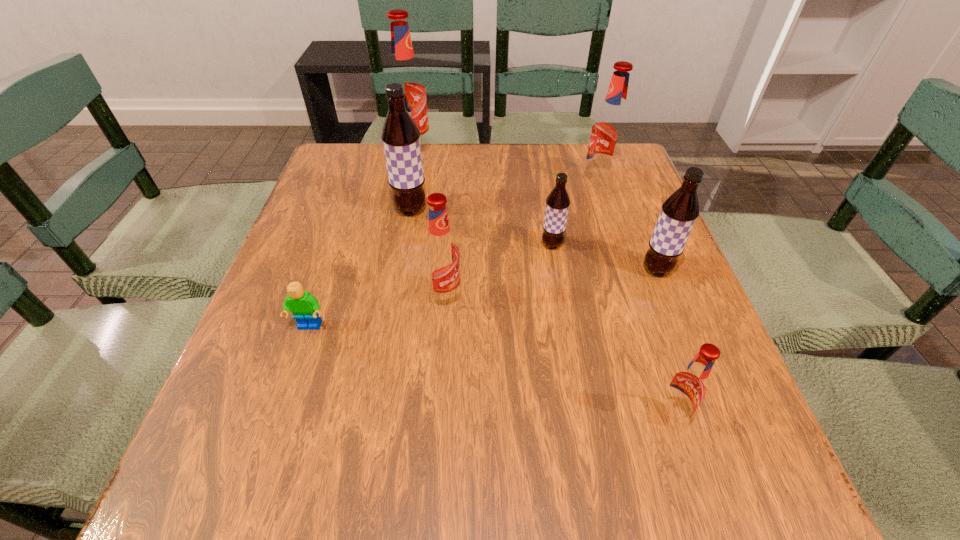
You are a GUI agent. You are given a task and a screenshot of the screen. Output one action in this format:
    pyautogui.click(x=<x>, y=<y>)
    Task: Click on the nearest red root beer
    
    Given the screenshot: What is the action you would take?
    pyautogui.click(x=687, y=388)

Locate an element on the screen. The width and height of the screenshot is (960, 540). the nearest root beer is located at coordinates (687, 388).

The height and width of the screenshot is (540, 960). I want to click on the fifth nearest object, so click(557, 203).

Where is `the fourth object from right to left`? the fourth object from right to left is located at coordinates (557, 203).

What are the coordinates of `the shortest object` in the screenshot? It's located at (304, 306).

Locate an element on the screen. The image size is (960, 540). the leftmost object is located at coordinates (304, 306).

Where is `blank space located on the right of the farthest object`? blank space located on the right of the farthest object is located at coordinates (463, 152).

The width and height of the screenshot is (960, 540). Find the location of `free spot located on the left of the third smallest red root beer`. free spot located on the left of the third smallest red root beer is located at coordinates click(433, 182).

You are a GUI agent. You are given a task and a screenshot of the screen. Output one action in this format:
    pyautogui.click(x=<x>, y=<y>)
    Task: Click on the free space located 0.280m on the back of the biggest brown root beer
    
    Given the screenshot: What is the action you would take?
    pyautogui.click(x=422, y=142)

This screenshot has width=960, height=540. I want to click on vacant region located 0.390m on the front of the rightmost brown root beer, so click(x=739, y=477).